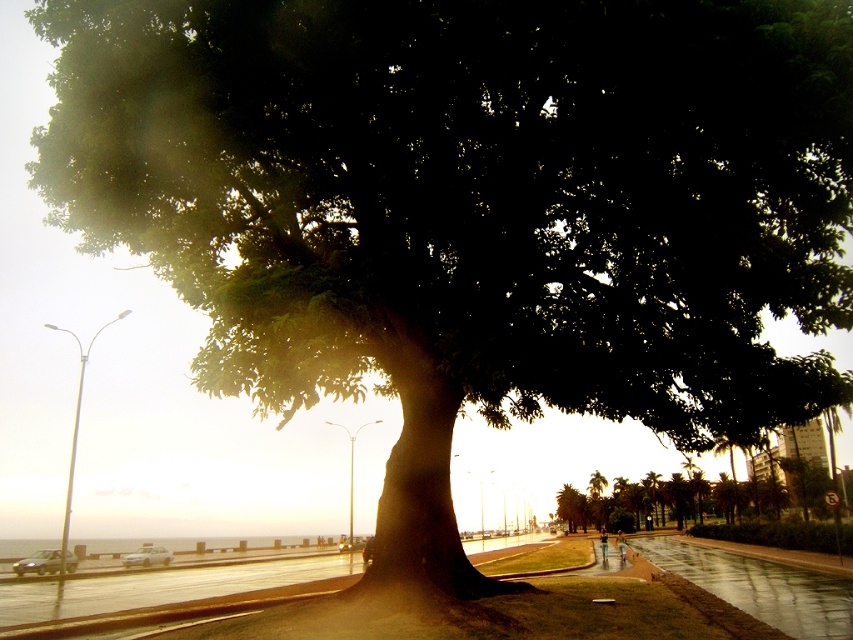
Does matte silver car at lower left appear over white glossy car at center?

Indeed, matte silver car at lower left is positioned over white glossy car at center.

Looking at this image, can you confirm if matte silver car at lower left is positioned below white glossy car at center?

No, matte silver car at lower left is not below white glossy car at center.

Is point (59, 554) in front of point (160, 557)?

Yes, point (59, 554) is closer to viewer.

The image size is (853, 640). Find the location of `matte silver car at lower left`. matte silver car at lower left is located at coordinates (38, 563).